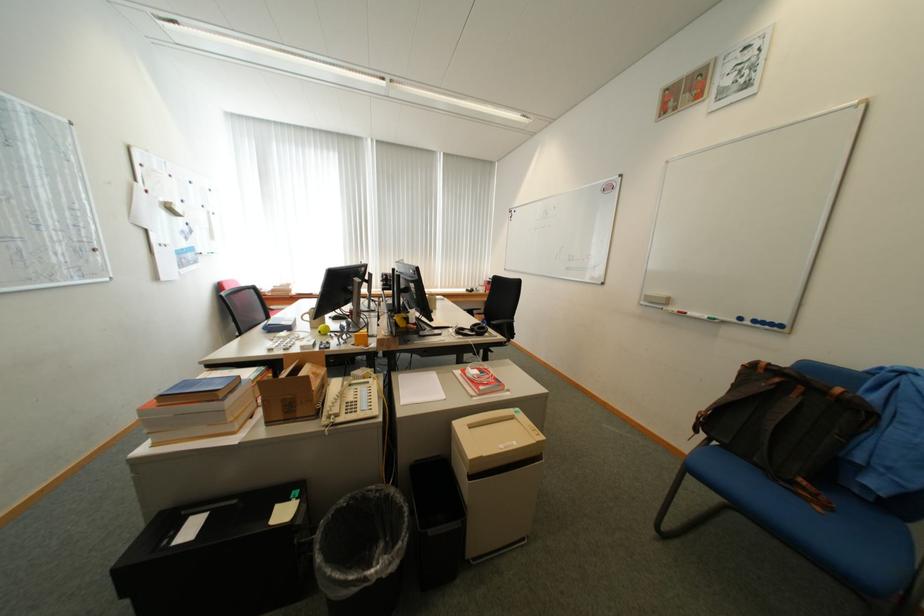
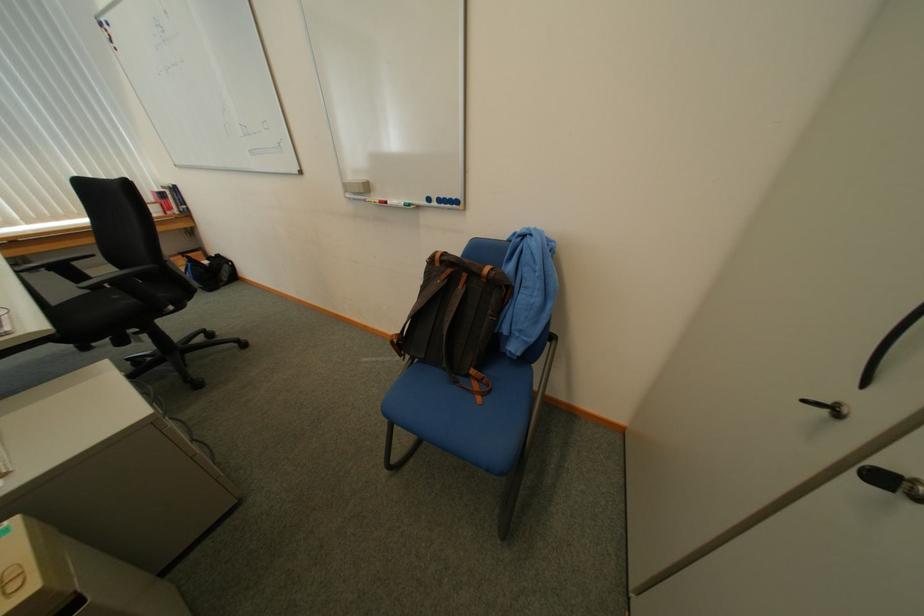
Locate, in the second image, the point that corresponds to (x=804, y=399) in the first image.

(469, 290)